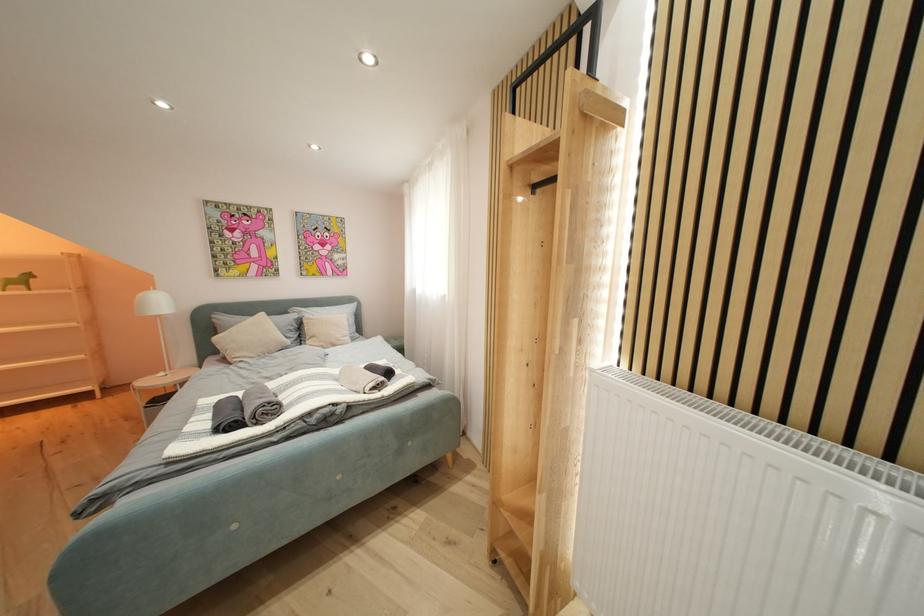
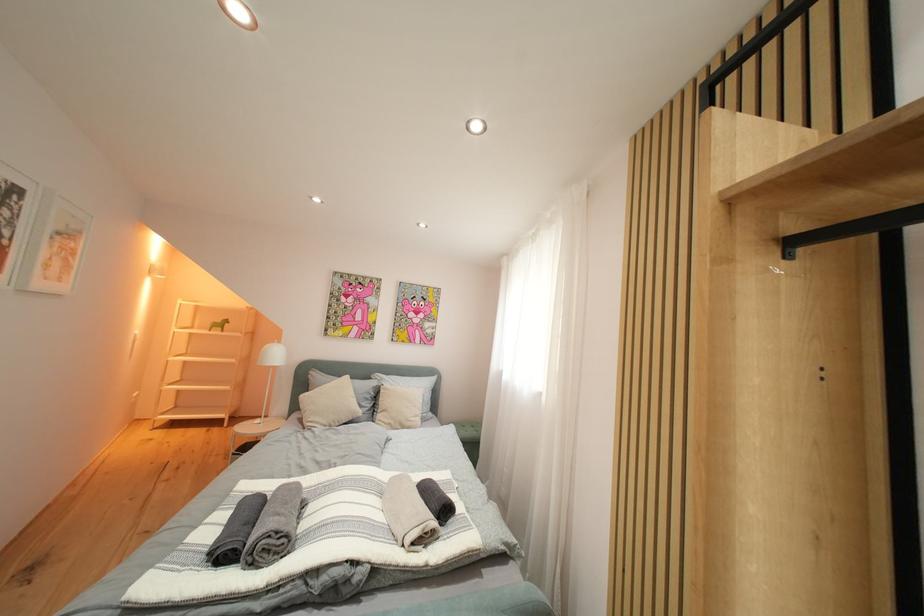
Question: Which direction would the cameraman need to move to produce the second image? Reply with the corresponding letter.

Choices:
 (A) Left
 (B) Right
 (C) Forward
 (D) Backward

Answer: (C)